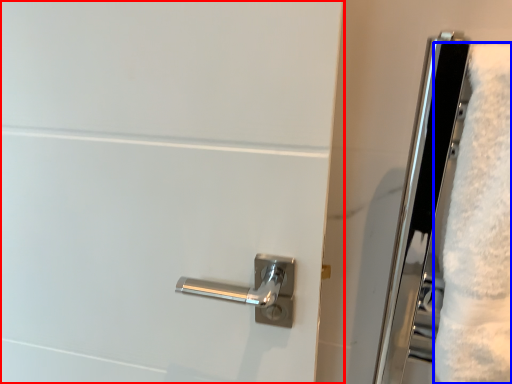
Question: Which object appears farthest to the camera in this image, door (highlighted by a red box) or bath towel (highlighted by a blue box)?

Choices:
 (A) door
 (B) bath towel

Answer: (A)